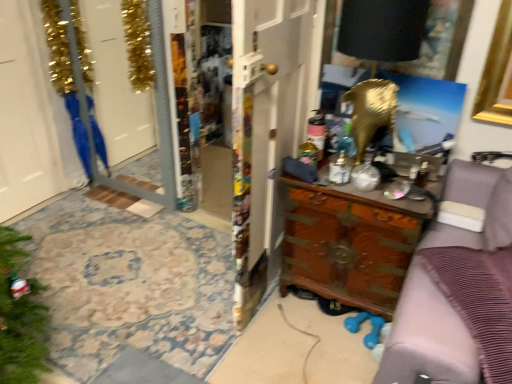
Locate an element on the screen. Image resolution: width=512 pixels, height=384 pixels. vacant area in front of wooden carved dresser at center is located at coordinates (315, 349).